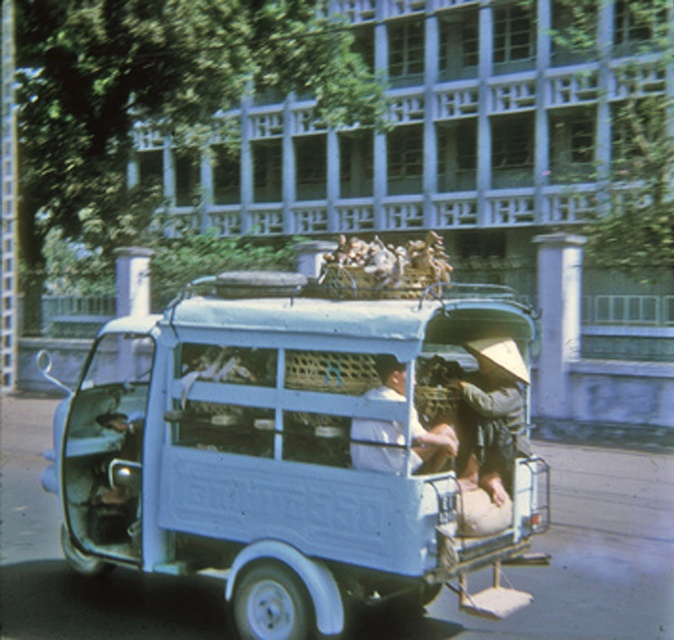
Question: Where is light blue matte van at center located in relation to light blue fabric shirt at center in the image?

Choices:
 (A) left
 (B) right

Answer: (B)

Question: Is light blue matte van at center positioned before light blue fabric shirt at center?

Choices:
 (A) no
 (B) yes

Answer: (A)

Question: Does light blue matte van at center have a lesser width compared to light blue fabric shirt at center?

Choices:
 (A) no
 (B) yes

Answer: (B)

Question: Which of the following is the farthest from the observer?

Choices:
 (A) light blue matte van at center
 (B) light blue fabric shirt at center

Answer: (A)

Question: Which object is closer to the camera taking this photo?

Choices:
 (A) light blue matte van at center
 (B) light blue fabric shirt at center

Answer: (B)